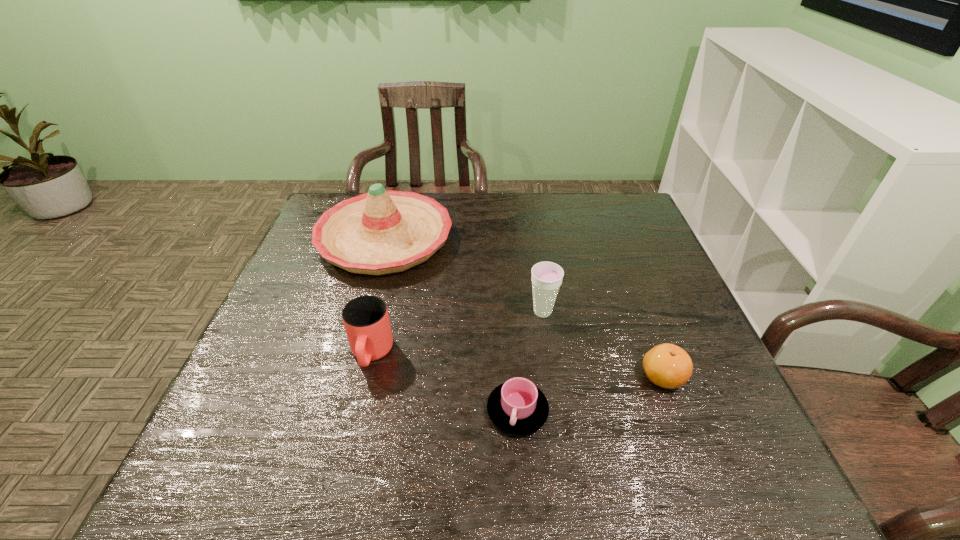
You are a GUI agent. You are given a task and a screenshot of the screen. Output one action in this format:
    pyautogui.click(x=<x>, y=<y>)
    Task: Click on the free space located 0.210m on the handle side of the leftmost cup
    This screenshot has height=540, width=960.
    Given the screenshot: What is the action you would take?
    (343, 477)

At what (x,y) coordinates should I click in order to perform the action: click on vacant position located on the front of the fourth tallest object. Please return your answer as a coordinate pair (x, y). This screenshot has height=540, width=960. Looking at the image, I should click on (699, 472).

Where is `object located at the far edge`? Image resolution: width=960 pixels, height=540 pixels. object located at the far edge is located at coordinates (380, 232).

The width and height of the screenshot is (960, 540). Identify the location of object at the left edge. (380, 232).

I want to click on object that is at the right edge, so click(666, 365).

Find the location of `object that is positioned at the far left corner`. object that is positioned at the far left corner is located at coordinates 380,232.

You are a GUI agent. You are given a task and a screenshot of the screen. Output one action in this format:
    pyautogui.click(x=<x>, y=<y>)
    Task: Click on the vacant area at the far edge
    This screenshot has width=960, height=540.
    Given the screenshot: What is the action you would take?
    pyautogui.click(x=436, y=195)

In the image, there is a desktop. In order to click on vacant region at the near edge in this screenshot , I will do `click(504, 476)`.

The width and height of the screenshot is (960, 540). In order to click on free space at the right edge of the desktop in this screenshot , I will do `click(712, 382)`.

Where is `vacant space at the far right corner`? The image size is (960, 540). vacant space at the far right corner is located at coordinates pyautogui.click(x=600, y=226).